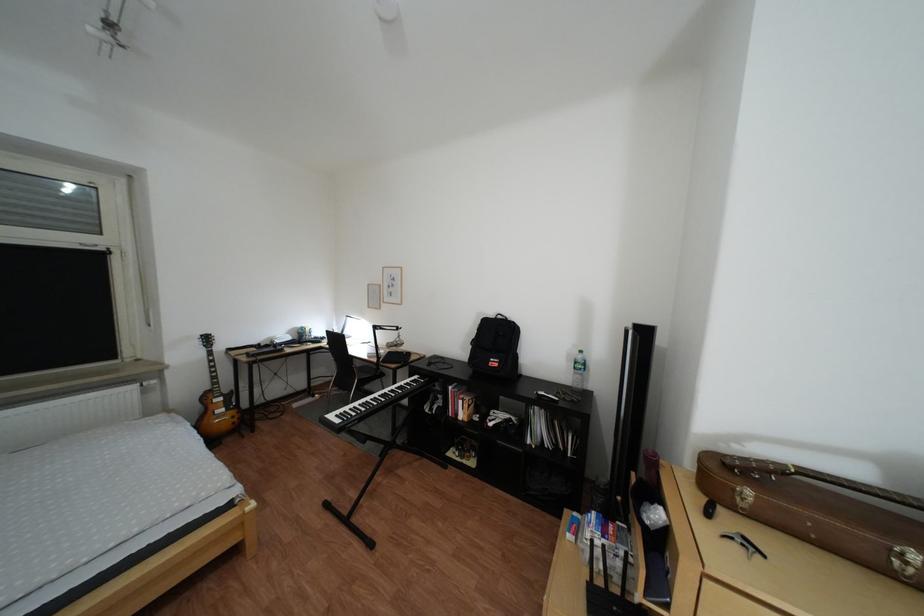
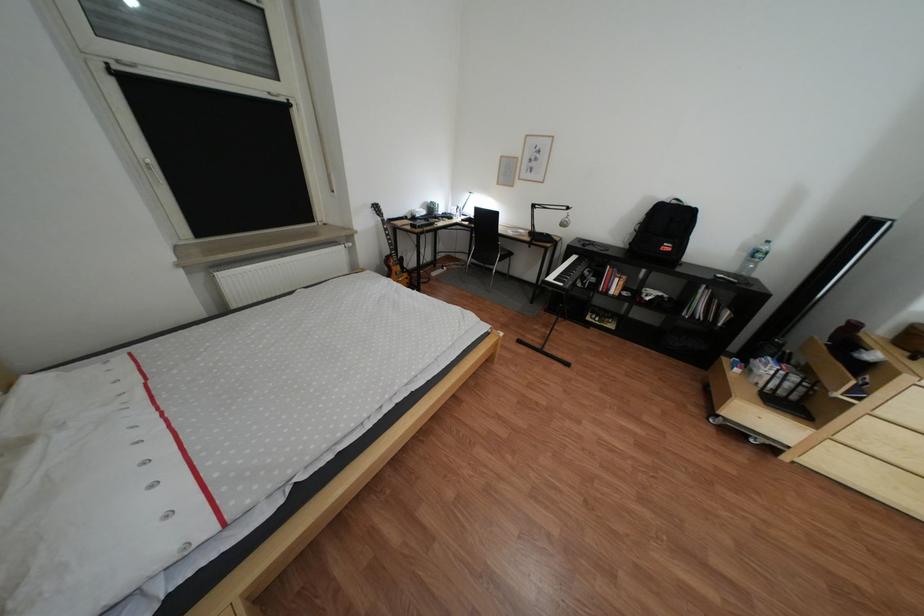
Question: In a continuous first-person perspective shot, in which direction is the camera moving?

Choices:
 (A) Left
 (B) Right
 (C) Forward
 (D) Backward

Answer: (A)